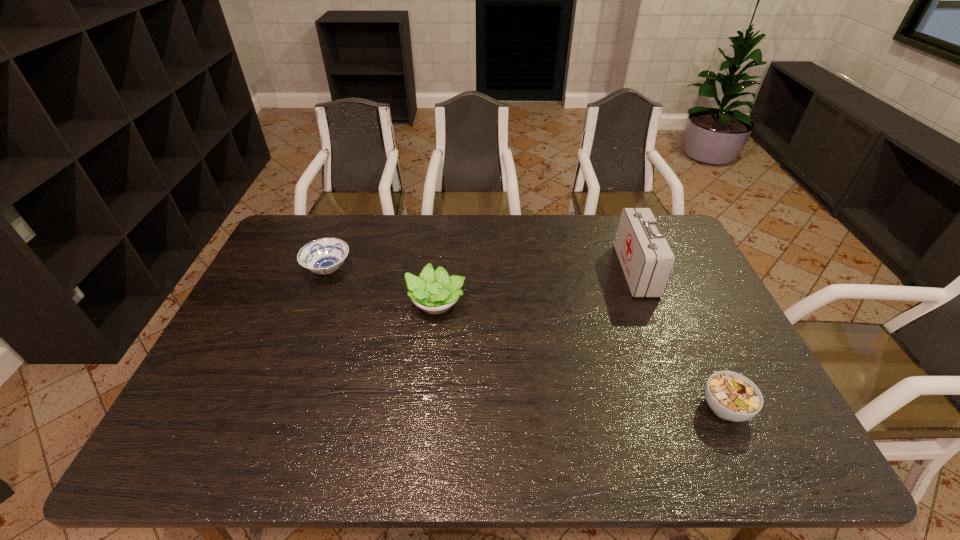
This screenshot has height=540, width=960. What are the coordinates of `the first-aid kit` in the screenshot? It's located at (647, 260).

Where is `the second tallest object`? the second tallest object is located at coordinates (435, 292).

Where is `the second object from left to right`? the second object from left to right is located at coordinates (435, 292).

Locate an element on the screen. the leftmost object is located at coordinates (323, 256).

Identify the location of the left soup bowl. This screenshot has height=540, width=960. (323, 256).

The width and height of the screenshot is (960, 540). I want to click on the nearest object, so click(x=731, y=396).

Where is `the right soup bowl`? The height and width of the screenshot is (540, 960). the right soup bowl is located at coordinates (731, 396).

The width and height of the screenshot is (960, 540). In order to click on free space located on the front-facing side of the tallest object in this screenshot , I will do `click(580, 271)`.

Find the location of a particular element. The height and width of the screenshot is (540, 960). vacant space located 0.090m on the front-facing side of the tallest object is located at coordinates (595, 271).

The height and width of the screenshot is (540, 960). In order to click on vacant space situated 0.310m on the front-facing side of the tallest object in this screenshot , I will do `click(528, 271)`.